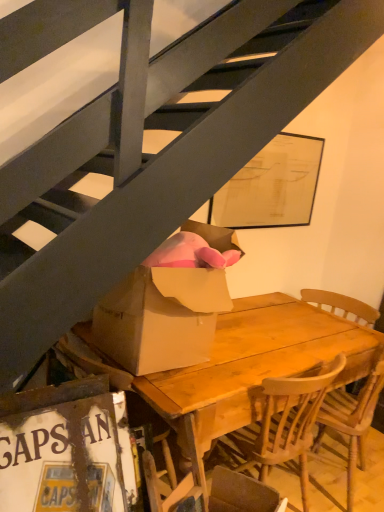
Question: Considering the relative positions of wooden chair at center and white cardboard sign at lower left in the image provided, is wooden chair at center to the right of white cardboard sign at lower left from the viewer's perspective?

Choices:
 (A) no
 (B) yes

Answer: (B)

Question: Is wooden chair at center taller than white cardboard sign at lower left?

Choices:
 (A) yes
 (B) no

Answer: (A)

Question: Is the depth of wooden chair at center greater than that of white cardboard sign at lower left?

Choices:
 (A) no
 (B) yes

Answer: (B)

Question: Is wooden chair at center placed right next to white cardboard sign at lower left?

Choices:
 (A) yes
 (B) no

Answer: (B)

Question: Does wooden chair at center have a larger size compared to white cardboard sign at lower left?

Choices:
 (A) yes
 (B) no

Answer: (A)

Question: Would you consider wooden chair at center to be distant from white cardboard sign at lower left?

Choices:
 (A) yes
 (B) no

Answer: (A)

Question: Does white cardboard sign at lower left have a smaller size compared to wooden chair at center?

Choices:
 (A) yes
 (B) no

Answer: (A)

Question: Can you confirm if white cardboard sign at lower left is positioned to the left of wooden chair at center?

Choices:
 (A) yes
 (B) no

Answer: (A)

Question: Is white cardboard sign at lower left aimed at wooden chair at center?

Choices:
 (A) yes
 (B) no

Answer: (B)

Question: From a real-world perspective, is white cardboard sign at lower left physically below wooden chair at center?

Choices:
 (A) no
 (B) yes

Answer: (A)

Question: Is wooden chair at center completely or partially inside white cardboard sign at lower left?

Choices:
 (A) yes
 (B) no

Answer: (B)

Question: Is white cardboard sign at lower left facing away from wooden chair at center?

Choices:
 (A) no
 (B) yes

Answer: (A)

Question: Is wooden table at center bigger than white cardboard sign at lower left?

Choices:
 (A) yes
 (B) no

Answer: (A)